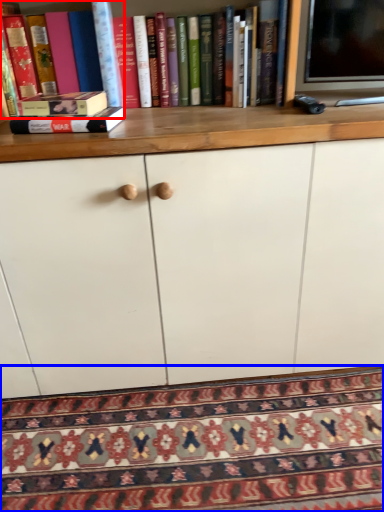
Question: Which object appears farthest to the camera in this image, book (highlighted by a red box) or mat (highlighted by a blue box)?

Choices:
 (A) book
 (B) mat

Answer: (A)